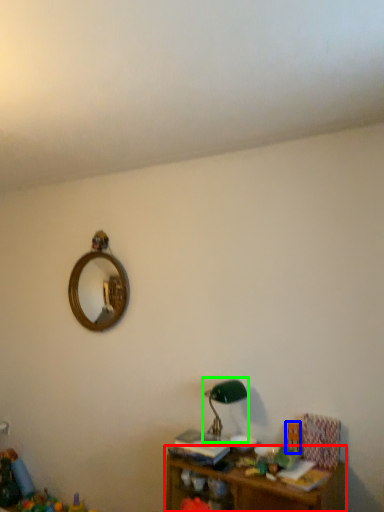
Question: Considering the real-world distances, which object is farthest from shelf (highlighted by a red box)? toy (highlighted by a blue box) or table lamp (highlighted by a green box)?

Choices:
 (A) toy
 (B) table lamp

Answer: (B)